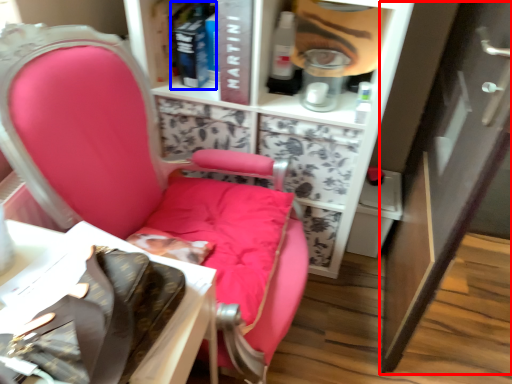
Question: Which of the following is the closest to the observer, cabinetry (highlighted by a red box) or book (highlighted by a blue box)?

Choices:
 (A) cabinetry
 (B) book

Answer: (A)